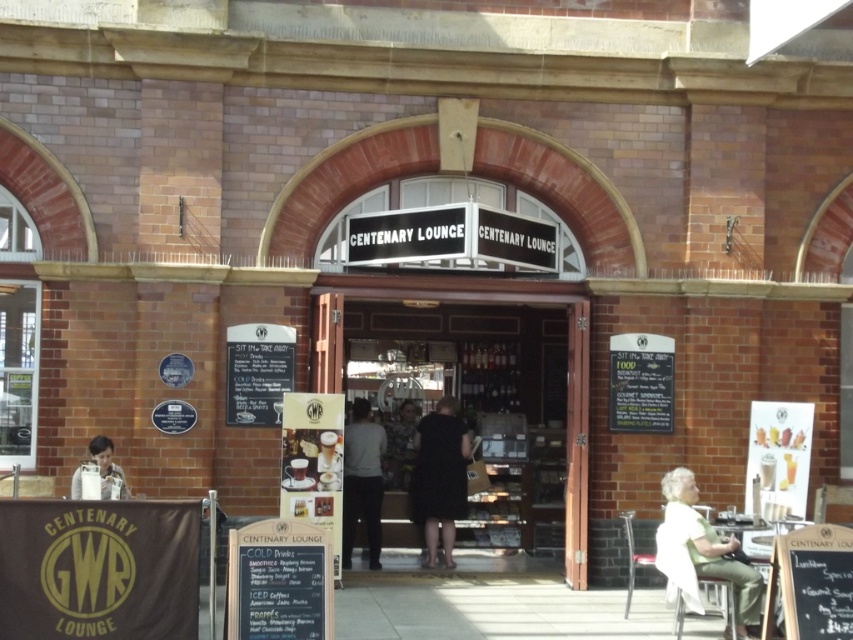
Measure the distance between dark gray fabric jacket at center and camera.

They are 48.75 feet apart.

Does dark gray fabric jacket at center appear over camouflage-patterned shirt at center?

Actually, dark gray fabric jacket at center is below camouflage-patterned shirt at center.

Does point (360, 417) come closer to viewer compared to point (399, 424)?

Yes, it is in front of point (399, 424).

Where is `dark gray fabric jacket at center`? dark gray fabric jacket at center is located at coordinates (363, 481).

Can you confirm if black dress at center is wider than matte white plate at lower left?

Indeed, black dress at center has a greater width compared to matte white plate at lower left.

The height and width of the screenshot is (640, 853). What do you see at coordinates (439, 477) in the screenshot?
I see `black dress at center` at bounding box center [439, 477].

Locate an element on the screen. This screenshot has height=640, width=853. black dress at center is located at coordinates (439, 477).

Which is behind, point (467, 444) or point (790, 593)?

Positioned behind is point (467, 444).

Does wooden door at center have a lesser width compared to black chalkboard at center?

In fact, wooden door at center might be wider than black chalkboard at center.

Who is more distant from viewer, (579, 432) or (845, 536)?

Positioned behind is point (579, 432).

Locate an element on the screen. The image size is (853, 640). wooden door at center is located at coordinates (577, 442).